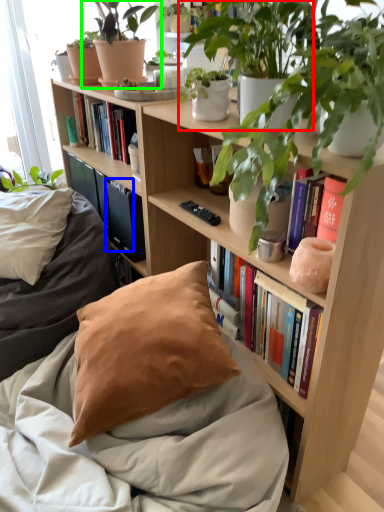
Question: Which is farther away from houseplant (highlighted by a red box)? paperback book (highlighted by a blue box) or houseplant (highlighted by a green box)?

Choices:
 (A) paperback book
 (B) houseplant

Answer: (A)